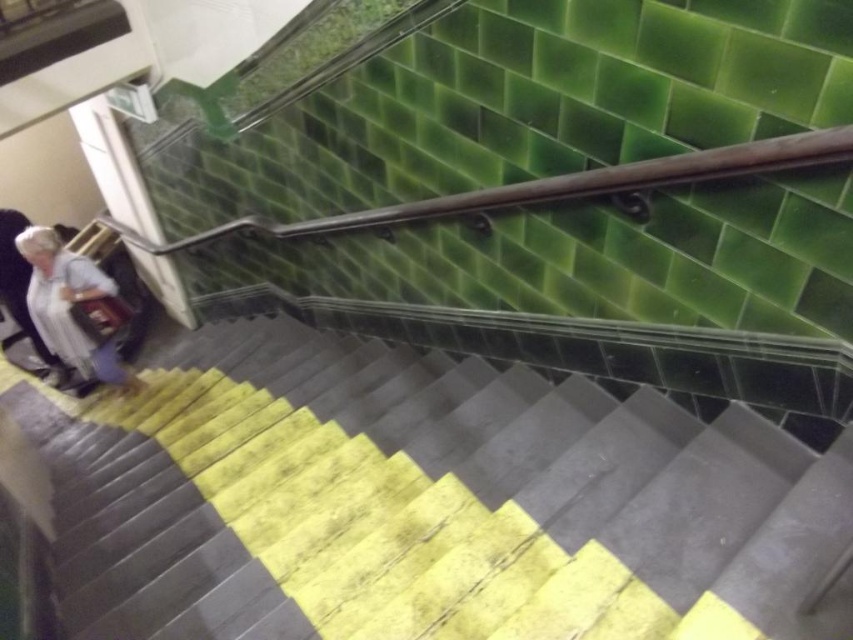
You are standing at the bottom of the staircase and see the wooden handrail at upper center and the light gray fabric coat at left. Which object is closer to you?

The wooden handrail at upper center is closer to you because it is in front of the light gray fabric coat at left.

You are standing at the bottom of the staircase and want to grab the wooden handrail at upper center. Can you reach it without moving your hand past the yellow rubber steps at lower left?

The wooden handrail at upper center is behind the yellow rubber steps at lower left, so you can reach it without moving your hand past the yellow rubber steps at lower left because it is positioned behind them.